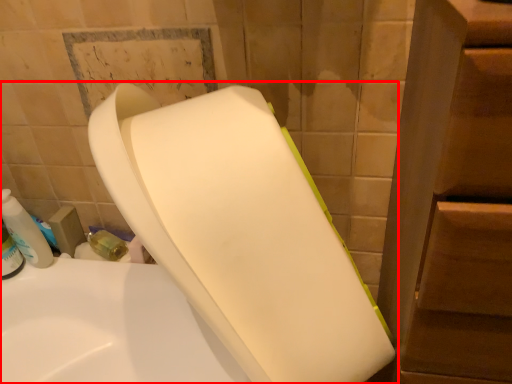
Question: From the image's perspective, where is toilet (annotated by the red box) located relative to cleaning product?

Choices:
 (A) below
 (B) above

Answer: (A)